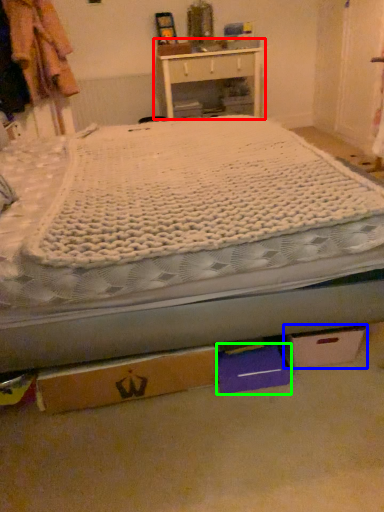
Question: Estimate the real-world distances between objects in this image. Which object is farther from nightstand (highlighted by a red box), cardboard box (highlighted by a blue box) or storage box (highlighted by a green box)?

Choices:
 (A) cardboard box
 (B) storage box

Answer: (B)